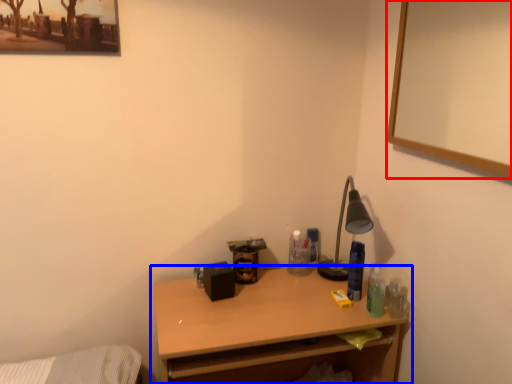
Question: Which object appears farthest to the camera in this image, picture frame (highlighted by a red box) or desk (highlighted by a blue box)?

Choices:
 (A) picture frame
 (B) desk

Answer: (B)